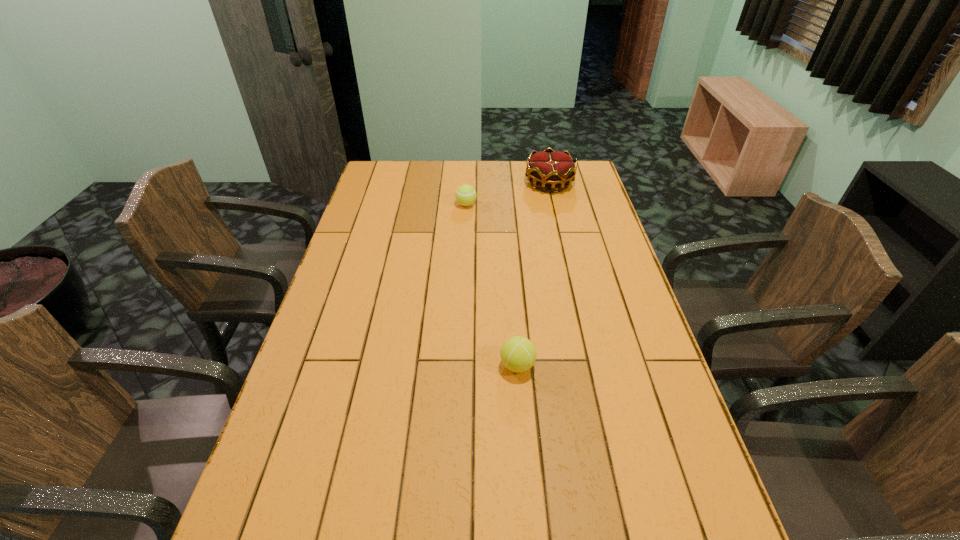
At what (x,y) coordinates should I click in order to perform the action: click on object positioned at the right edge. Please return your answer as a coordinate pair (x, y). This screenshot has height=540, width=960. Looking at the image, I should click on (550, 168).

This screenshot has width=960, height=540. Identify the location of object located at the far right corner. (550, 168).

You are a GUI agent. You are given a task and a screenshot of the screen. Output one action in this format:
    pyautogui.click(x=<x>, y=<y>)
    Task: Click on the vacant space at the far edge of the desktop
    The height and width of the screenshot is (540, 960).
    Given the screenshot: What is the action you would take?
    pyautogui.click(x=509, y=161)

The width and height of the screenshot is (960, 540). I want to click on free location at the left edge, so click(364, 200).

In the image, there is a desktop. Identify the location of blank space at the right edge. (576, 217).

Identify the location of unoccupied position between the nearest object and the leftmost object. (492, 285).

Locate an element on the screen. unoccupied position between the left tennis ball and the nearest object is located at coordinates (492, 285).

Where is `free point between the nearest object and the leftmost object`? This screenshot has width=960, height=540. free point between the nearest object and the leftmost object is located at coordinates [x=492, y=285].

Where is `vacant area that lies between the nearer tennis ball and the second nearest object`? The height and width of the screenshot is (540, 960). vacant area that lies between the nearer tennis ball and the second nearest object is located at coordinates [492, 285].

Find the location of a particular element. free spot between the crown and the second nearest object is located at coordinates (508, 194).